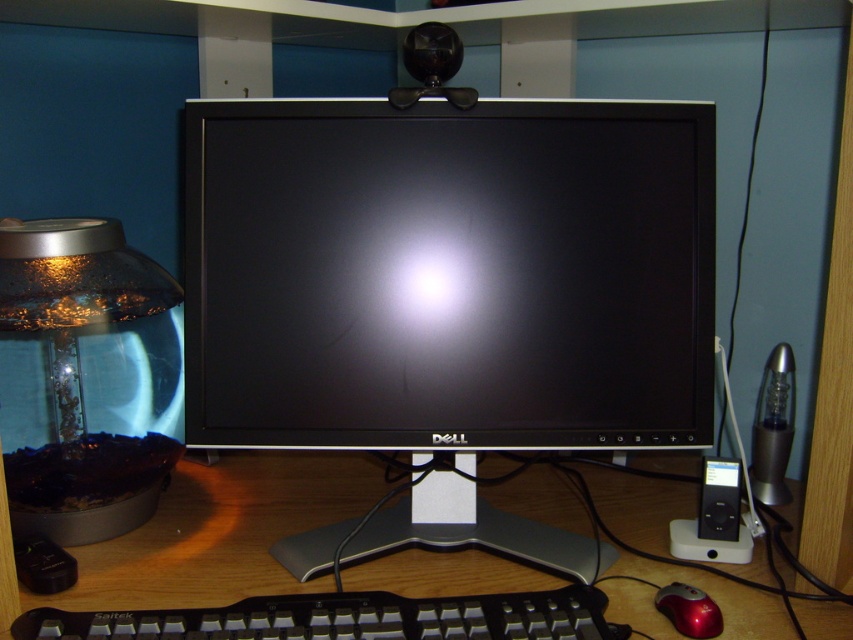
You are setting up a new monitor on a desk and need to place it exactly at point (264, 544). However, there is already an object at that location. What object is blocking the placement of the monitor?

The wooden at center is located at point (264, 544), so it is blocking the placement of the monitor.

What is the location of the wooden at center in the image?

The wooden at center is located at point (264, 544).